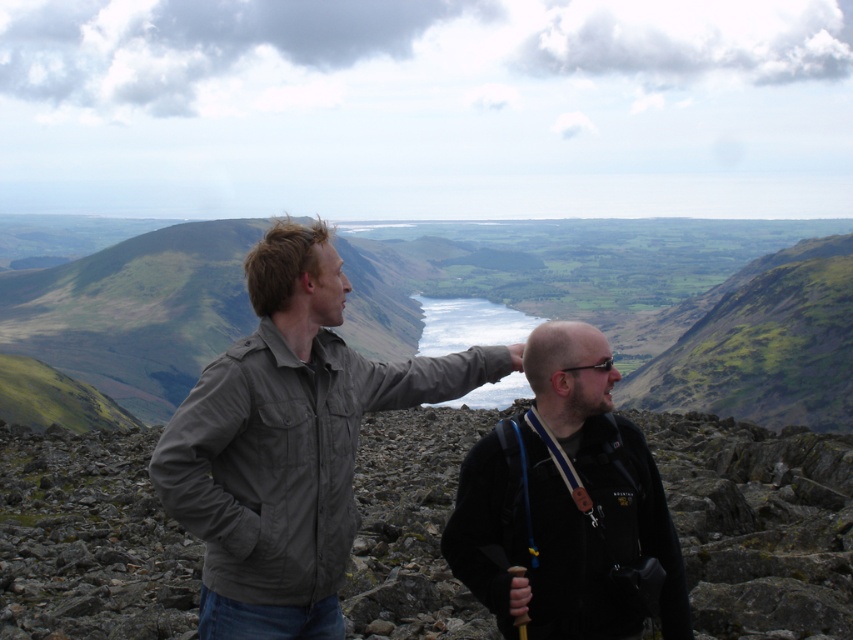
You are a photographer trying to capture both the khaki fabric jacket at left and the black fleece jacket at center in a single frame. Which jacket will appear larger in the photo?

The khaki fabric jacket at left will appear larger in the photo because it is larger in size than the black fleece jacket at center.

You are standing at the point labeled point [688,625] and want to move towards the point labeled point [252,522]. Given that the rocky terrain is uneven and has a 10 meter drop at the edge, is there a safe path directly between these two points?

Point [252,522] is behind point [688,625], so moving directly between them would require going towards the edge where there is a 10 meter drop, which is not safe. Therefore, there is no safe path directly between these two points.

You are planning to place a small flag on the rough stone boulders at center and the khaki fabric jacket at left. Which location is closer to you where you can place the flag more easily?

The khaki fabric jacket at left is closer to you than the rough stone boulders at center, so placing the flag there would be easier.